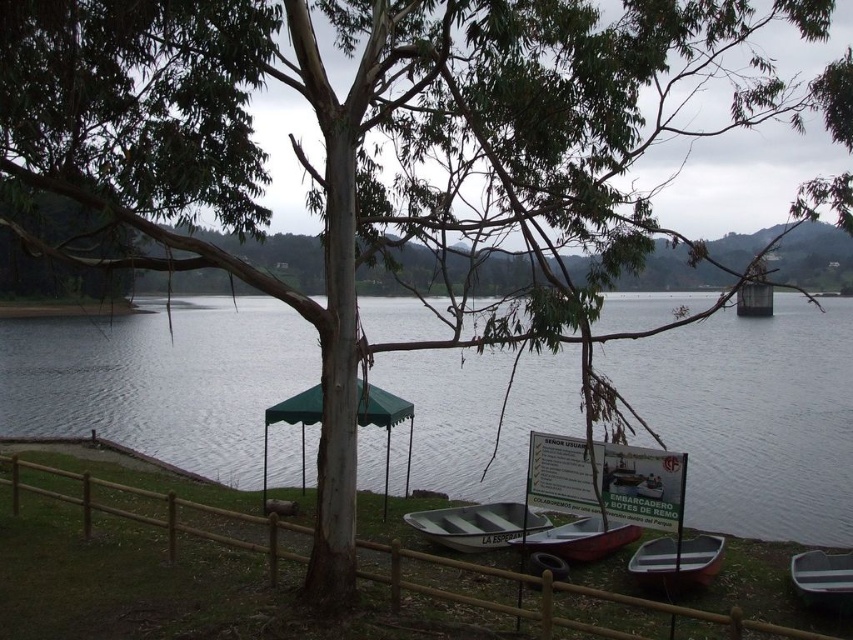
Question: Is brown wooden fence at lower center bigger than green fabric umbrella at center?

Choices:
 (A) no
 (B) yes

Answer: (B)

Question: In this image, where is brown wooden fence at lower center located relative to white plastic boat at lower right?

Choices:
 (A) left
 (B) right

Answer: (A)

Question: Is transparent water at center smaller than white plastic canoe at center?

Choices:
 (A) yes
 (B) no

Answer: (B)

Question: Which is farther from the green fabric umbrella at center?

Choices:
 (A) brown wooden fence at lower center
 (B) green plastic boat at lower right
 (C) transparent water at center
 (D) white striped boat at center

Answer: (B)

Question: Which object appears closest to the camera in this image?

Choices:
 (A) brown wooden fence at lower center
 (B) green plastic boat at lower right
 (C) green fabric umbrella at center
 (D) white striped boat at center

Answer: (A)

Question: Which is nearer to the green plastic boat at lower right?

Choices:
 (A) green fabric umbrella at center
 (B) white striped boat at center
 (C) transparent water at center
 (D) brown wooden fence at lower center

Answer: (D)